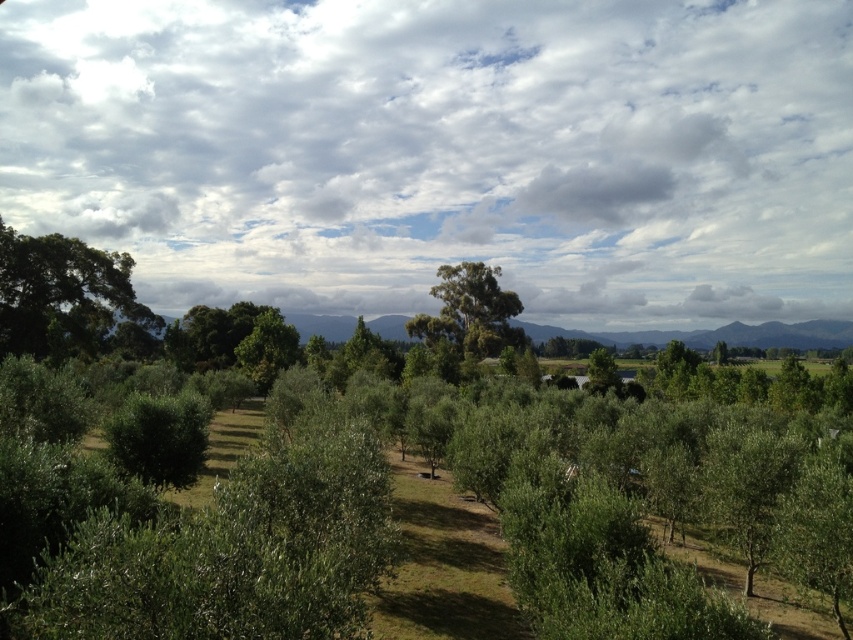
Question: Which point is closer to the camera?

Choices:
 (A) green leafy tree at left
 (B) cloudy sky at upper center
 (C) green leafy tree at center

Answer: (A)

Question: Which of the following is the farthest from the observer?

Choices:
 (A) (138, 307)
 (B) (244, 12)
 (C) (463, 298)

Answer: (B)

Question: From the image, what is the correct spatial relationship of green leafy tree at left in relation to green leafy tree at center?

Choices:
 (A) above
 (B) below

Answer: (B)

Question: Does cloudy sky at upper center have a smaller size compared to green leafy tree at left?

Choices:
 (A) yes
 (B) no

Answer: (B)

Question: Which point appears farthest from the camera in this image?

Choices:
 (A) (85, 244)
 (B) (494, 300)

Answer: (B)

Question: Does cloudy sky at upper center appear under green leafy tree at center?

Choices:
 (A) no
 (B) yes

Answer: (A)